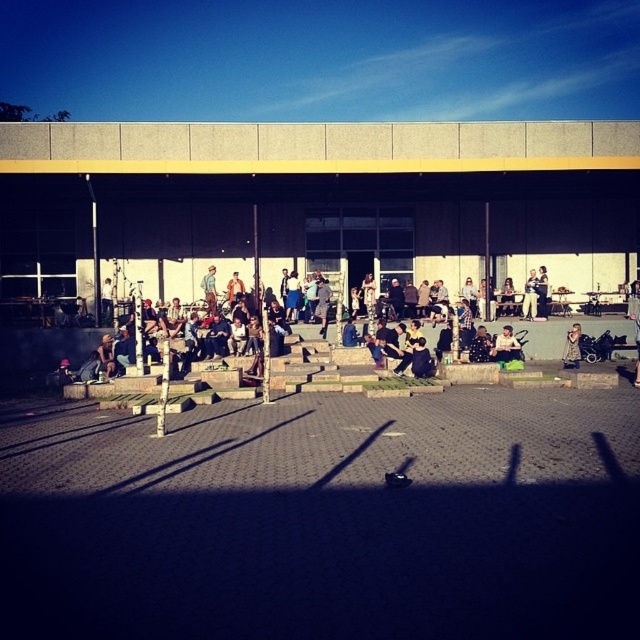
Does point (502, 356) come closer to viewer compared to point (563, 355)?

Yes, point (502, 356) is closer to viewer.

Is matte black jacket at center taller than denim jacket at lower right?

In fact, matte black jacket at center may be shorter than denim jacket at lower right.

Where is `matte black jacket at center`? The width and height of the screenshot is (640, 640). matte black jacket at center is located at coordinates (506, 346).

Image resolution: width=640 pixels, height=640 pixels. Find the location of `matte black jacket at center`. matte black jacket at center is located at coordinates (506, 346).